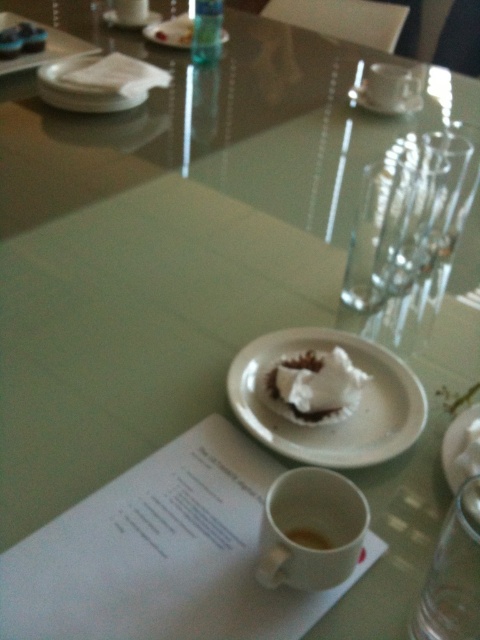
Question: Can you confirm if translucent glass bottle at upper center is positioned to the right of white matte saucer at upper center?

Choices:
 (A) yes
 (B) no

Answer: (A)

Question: Observing the image, what is the correct spatial positioning of white matte plate at upper center in reference to white matte saucer at center?

Choices:
 (A) left
 (B) right

Answer: (A)

Question: Can you confirm if white matte cup at lower center is positioned to the left of white matte saucer at upper center?

Choices:
 (A) no
 (B) yes

Answer: (A)

Question: Which of the following is the closest to the observer?

Choices:
 (A) (313, 545)
 (B) (469, 472)
 (C) (415, 429)

Answer: (A)

Question: Based on their relative distances, which object is farther from the white matte plate at upper center?

Choices:
 (A) transparent glass at lower right
 (B) white paper plate at center
 (C) white matte saucer at center
 (D) translucent glass bottle at upper center

Answer: (A)

Question: Which object appears farthest from the camera in this image?

Choices:
 (A) white matte cup at lower center
 (B) white fluffy dessert at center

Answer: (B)